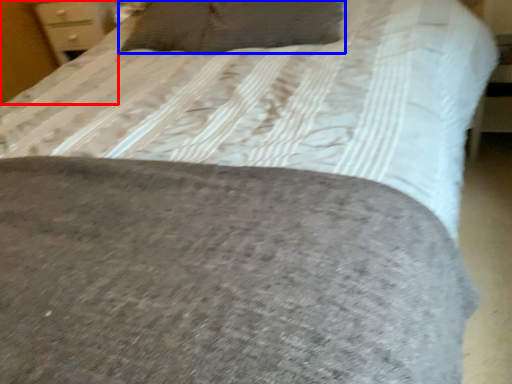
Question: Among these objects, which one is nearest to the camera, dresser (highlighted by a red box) or pillow (highlighted by a blue box)?

Choices:
 (A) dresser
 (B) pillow

Answer: (B)